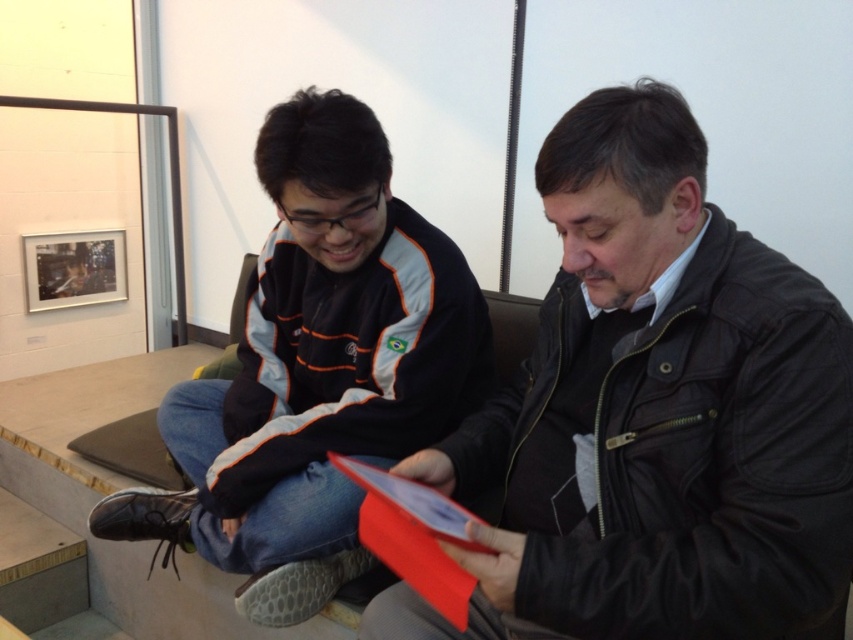
Is point (576, 488) positioned before point (264, 604)?

Yes, it is.

Is leather jacket at center taller than matte black jacket at center?

No, leather jacket at center is not taller than matte black jacket at center.

Which is behind, point (787, 317) or point (321, 145)?

Positioned behind is point (321, 145).

Locate an element on the screen. Image resolution: width=853 pixels, height=640 pixels. leather jacket at center is located at coordinates (654, 417).

Between leather jacket at center and leather textured shoe at lower left, which one appears on the left side from the viewer's perspective?

leather textured shoe at lower left

Who is positioned more to the right, leather jacket at center or leather textured shoe at lower left?

leather jacket at center is more to the right.

Which is in front, point (633, 497) or point (328, 588)?

Point (633, 497)

Where is `leather jacket at center`? leather jacket at center is located at coordinates (654, 417).

Does leather textured shoe at lower left have a greater height compared to black leather shoe at lower left?

Incorrect, leather textured shoe at lower left's height is not larger of black leather shoe at lower left's.

Which is more to the left, leather textured shoe at lower left or black leather shoe at lower left?

Positioned to the left is black leather shoe at lower left.

The width and height of the screenshot is (853, 640). Identify the location of leather textured shoe at lower left. (299, 588).